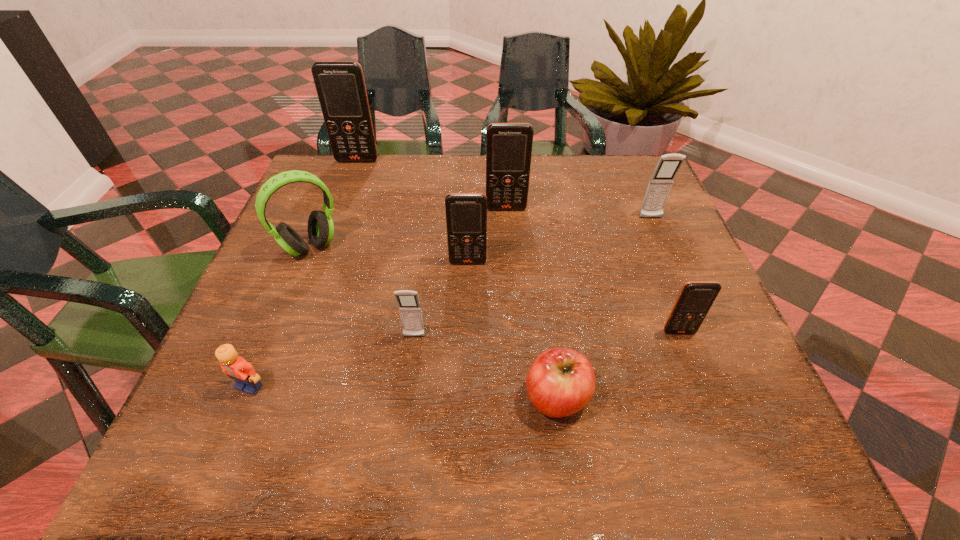
Find the location of a particular element. The height and width of the screenshot is (540, 960). vacant space in between the seventh nearest object and the Lego is located at coordinates (450, 302).

The height and width of the screenshot is (540, 960). Find the location of `free space between the headset and the third biggest orange cellular telephone`. free space between the headset and the third biggest orange cellular telephone is located at coordinates (389, 255).

Find the location of a particular element. The height and width of the screenshot is (540, 960). unoccupied position between the apple and the bigger gray cellular telephone is located at coordinates (604, 308).

Find the location of a particular element. Image resolution: width=960 pixels, height=540 pixels. vacant point located between the farther gray cellular telephone and the eighth nearest object is located at coordinates (578, 213).

The height and width of the screenshot is (540, 960). Find the location of `object that is the fifth closest to the smaller gray cellular telephone`. object that is the fifth closest to the smaller gray cellular telephone is located at coordinates (508, 145).

Find the location of `object that is the third closest to the fifth shortest cellular telephone`. object that is the third closest to the fifth shortest cellular telephone is located at coordinates (320, 225).

Locate an element on the screen. The width and height of the screenshot is (960, 540). cellular telephone that is the fifth closest to the bigger gray cellular telephone is located at coordinates (340, 85).

Identify which cellular telephone is the fourth nearest to the sixth object from right to left. Please provide its 2D coordinates. Your answer should be formatted as a tuple, i.e. [(x, y)], where the tuple contains the x and y coordinates of a point satisfying the conditions above.

[(659, 186)]

This screenshot has height=540, width=960. I want to click on orange cellular telephone that is the closest to the Lego, so click(x=466, y=213).

What are the coordinates of `orange cellular telephone that is the third nearest to the headset` in the screenshot? It's located at (508, 145).